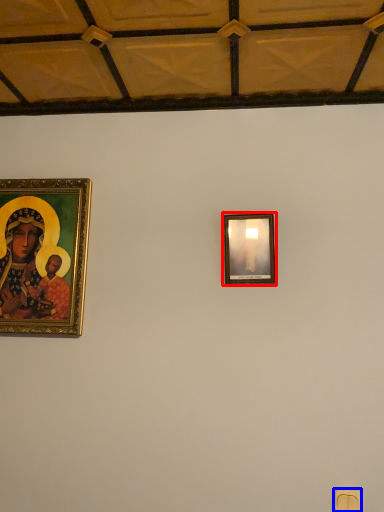
Question: Which object appears farthest to the camera in this image, picture frame (highlighted by a red box) or light switch (highlighted by a blue box)?

Choices:
 (A) picture frame
 (B) light switch

Answer: (A)